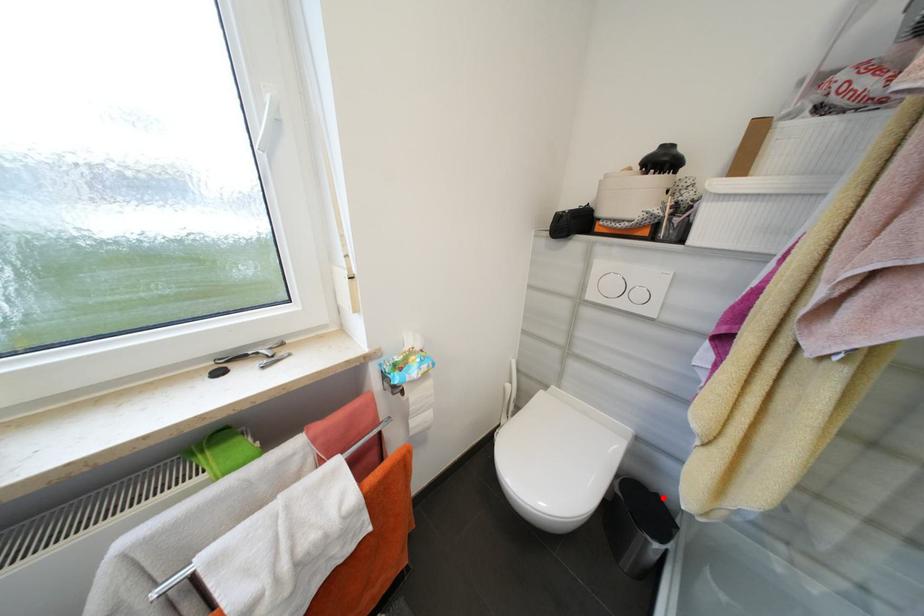
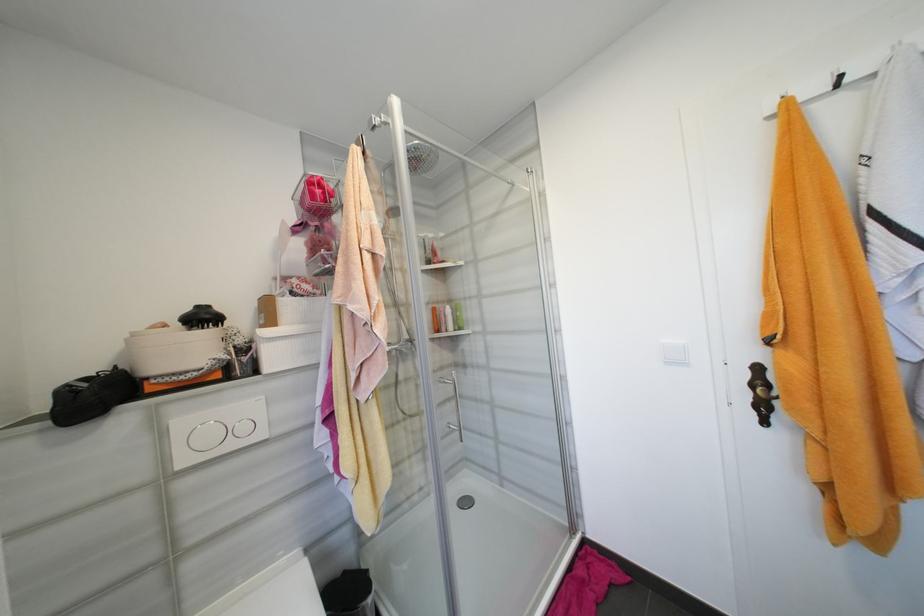
Question: I am providing you with two images of the same scene from different viewpoints. Image1 has a red point marked. In image2, the corresponding 3D location appears at what relative position? Reply with the corresponding letter.

Choices:
 (A) Closer
 (B) Farther

Answer: (A)